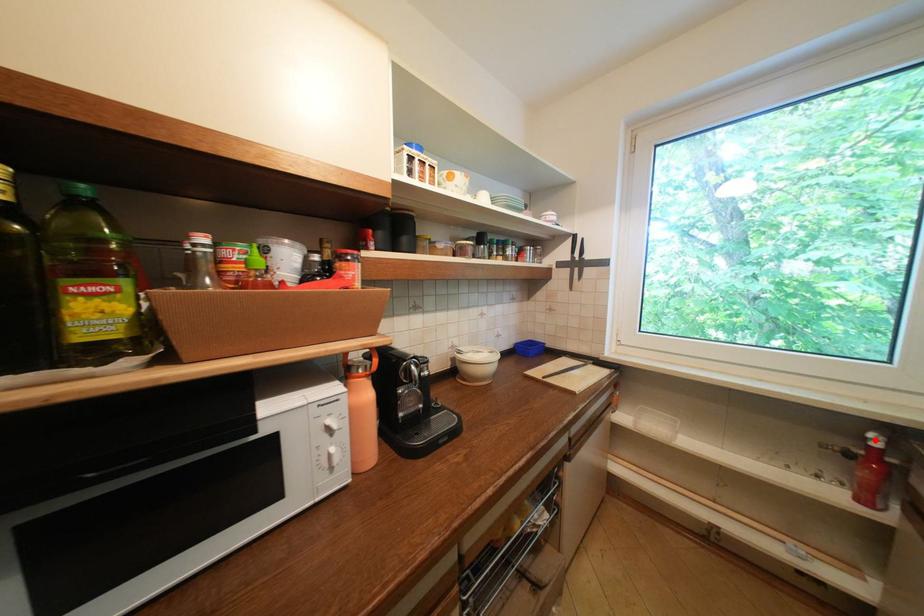
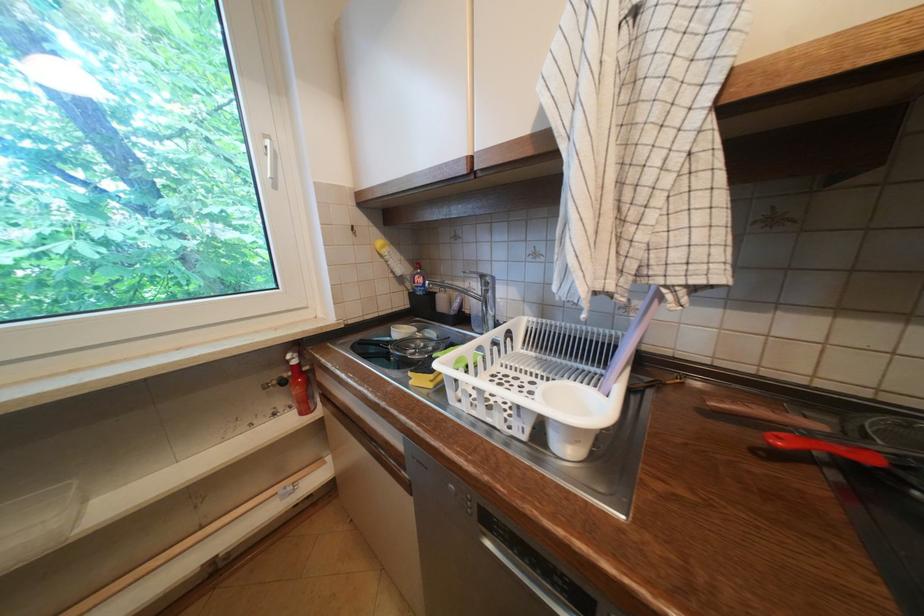
Question: I am providing you with two images of the same scene from different viewpoints. A red point is marked on the first image. Is the red point's position out of view in image 2?

Choices:
 (A) Yes
 (B) No

Answer: (B)